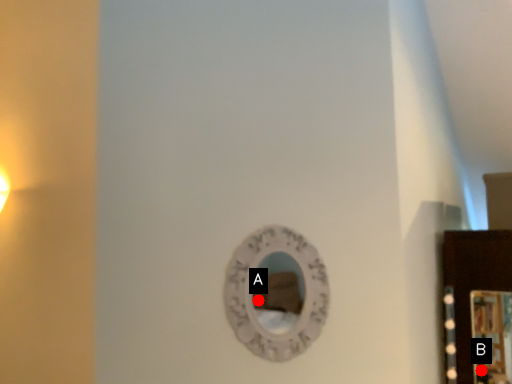
Question: Two points are circled on the image, labeled by A and B beside each circle. Which point appears farthest from the camera in this image?

Choices:
 (A) A is further
 (B) B is further

Answer: (B)